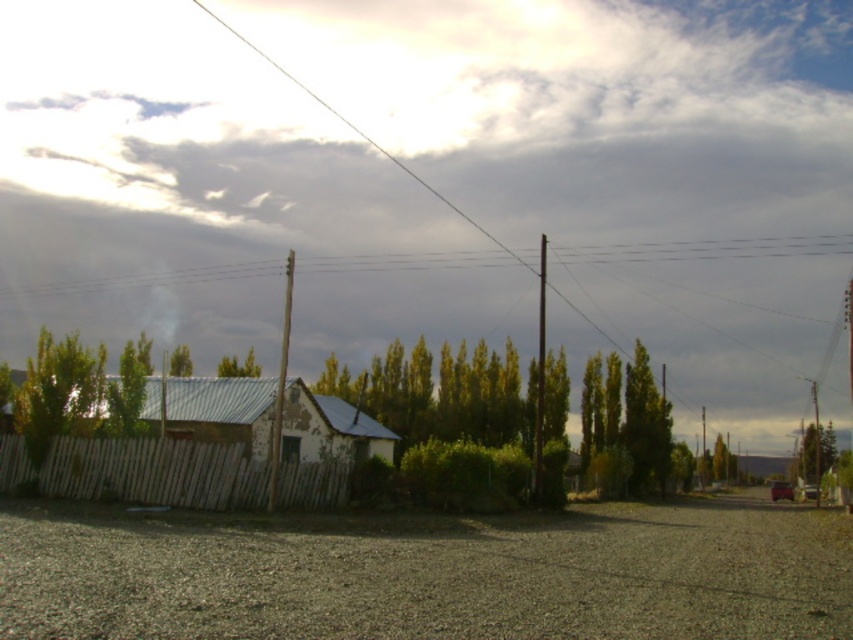
Between gray gravel at lower center and white wooden fence at lower left, which one is positioned higher?

white wooden fence at lower left is higher up.

Who is shorter, gray gravel at lower center or white wooden fence at lower left?

white wooden fence at lower left

Is point (442, 627) closer to camera compared to point (215, 502)?

Yes.

At what (x,y) coordinates should I click in order to perform the action: click on gray gravel at lower center. Please return your answer as a coordinate pair (x, y). This screenshot has width=853, height=640. Looking at the image, I should click on (428, 576).

Can you confirm if gray gravel at lower center is bigger than smooth wire at upper center?

Incorrect, gray gravel at lower center is not larger than smooth wire at upper center.

Is point (790, 600) in front of point (343, 256)?

Yes, point (790, 600) is in front of point (343, 256).

Identify the location of gray gravel at lower center. The image size is (853, 640). (428, 576).

Which is above, white wooden fence at lower left or smooth wire at upper center?

smooth wire at upper center is above.

Between white wooden fence at lower left and smooth wire at upper center, which one appears on the left side from the viewer's perspective?

From the viewer's perspective, white wooden fence at lower left appears more on the left side.

The image size is (853, 640). I want to click on white wooden fence at lower left, so click(138, 472).